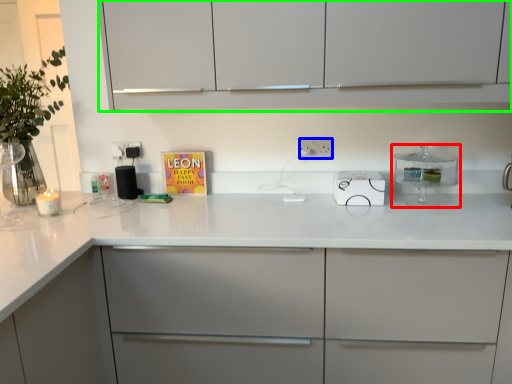
Question: Which is nearer to the kitchen appliance (highlighted by a red box)? electric outlet (highlighted by a blue box) or cabinetry (highlighted by a green box).

Choices:
 (A) electric outlet
 (B) cabinetry

Answer: (A)